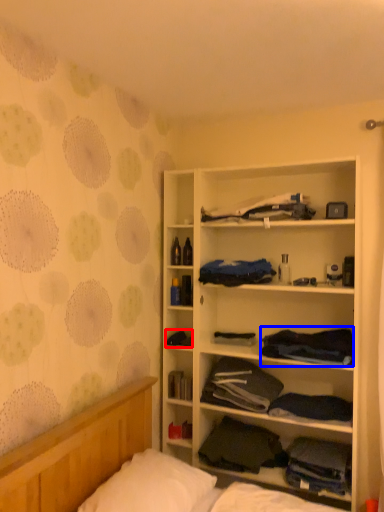
Question: Which point is closer to the camera, clothing (highlighted by a red box) or clothing (highlighted by a blue box)?

Choices:
 (A) clothing
 (B) clothing

Answer: (B)